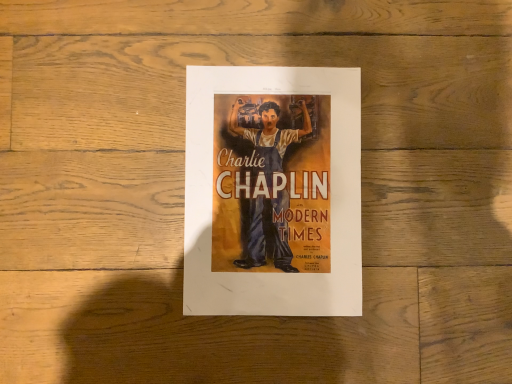
Describe the element at coordinates (273, 191) in the screenshot. The height and width of the screenshot is (384, 512). I see `matte paper poster at center` at that location.

Looking at this image, in order to face matte paper poster at center, should I rotate leftwards or rightwards?

You should rotate right by 2.591 degrees.

What are the coordinates of `matte paper poster at center` in the screenshot? It's located at (273, 191).

Identify the location of matte paper poster at center. (273, 191).